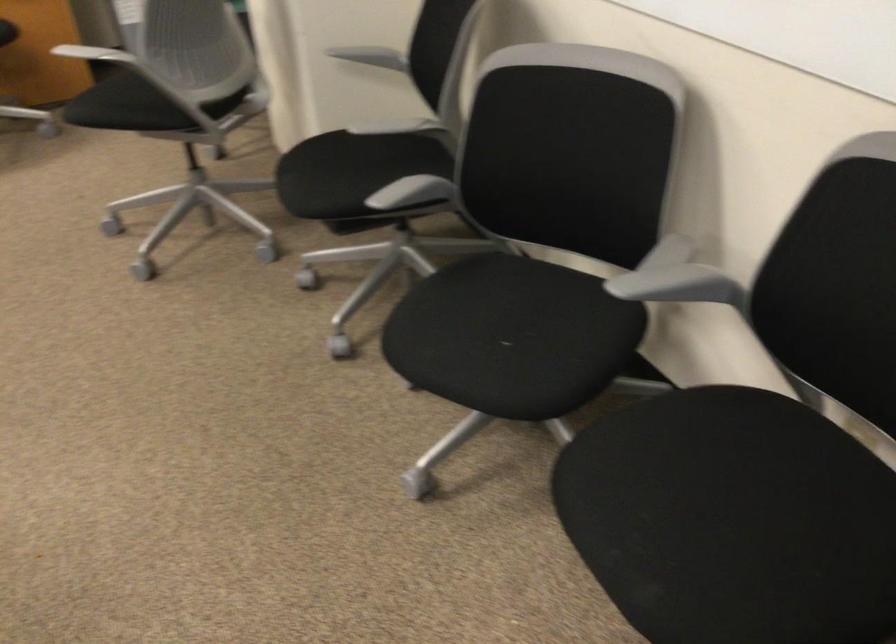
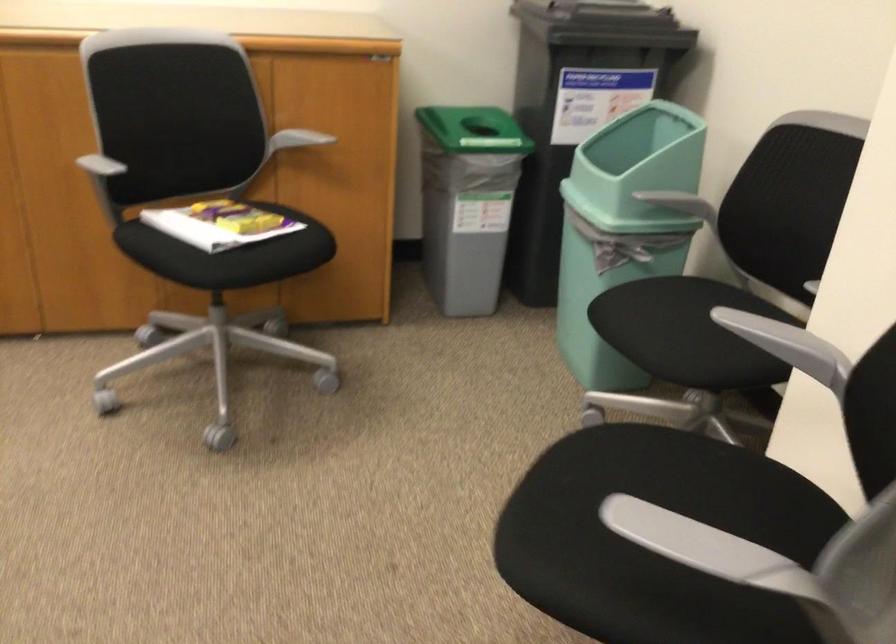
Which direction would the cameraman need to move to produce the second image?

The cameraman moved toward left, forward.